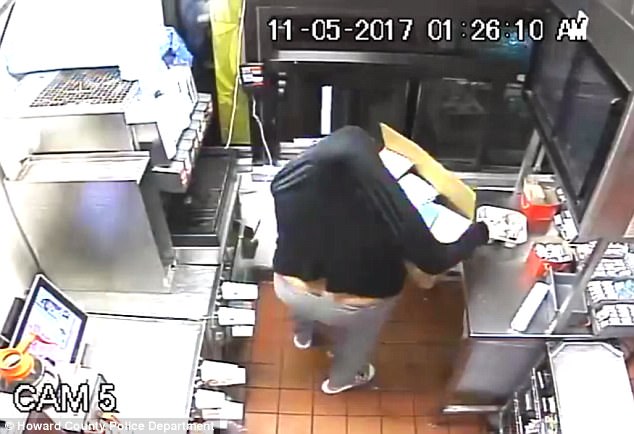
Locate an element on the screen. This screenshot has height=434, width=634. empty space on stainless steel counter is located at coordinates (495, 295).